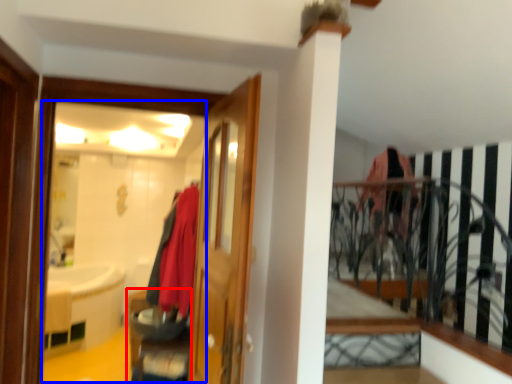
Question: Which object is further to the camera taking this photo, furniture (highlighted by a red box) or mirror (highlighted by a blue box)?

Choices:
 (A) furniture
 (B) mirror

Answer: (A)